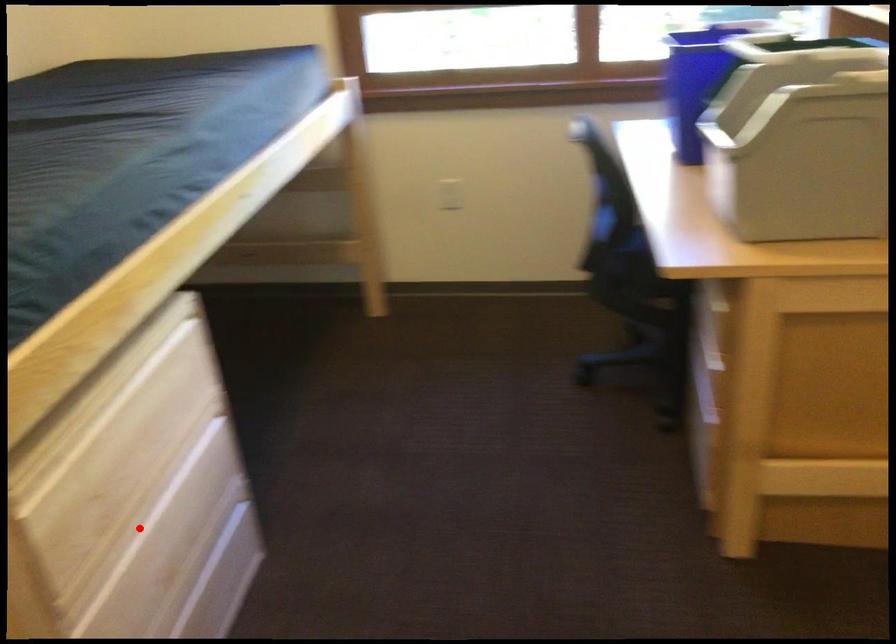
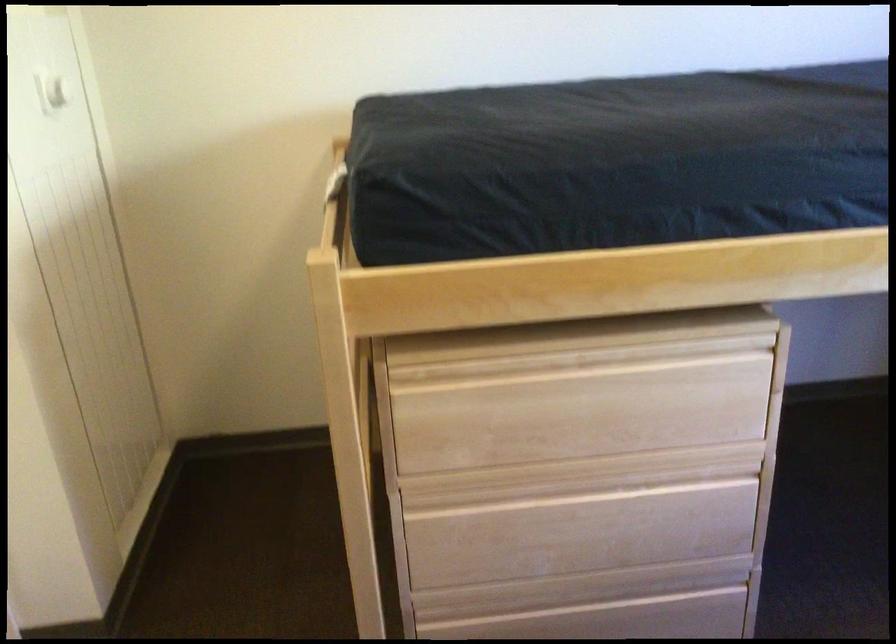
Question: I am providing you with two images of the same scene from different viewpoints. A red point is marked on the first image. At the location where the point appears in image 1, is it still visible in image 2?

Choices:
 (A) Yes
 (B) No

Answer: (A)